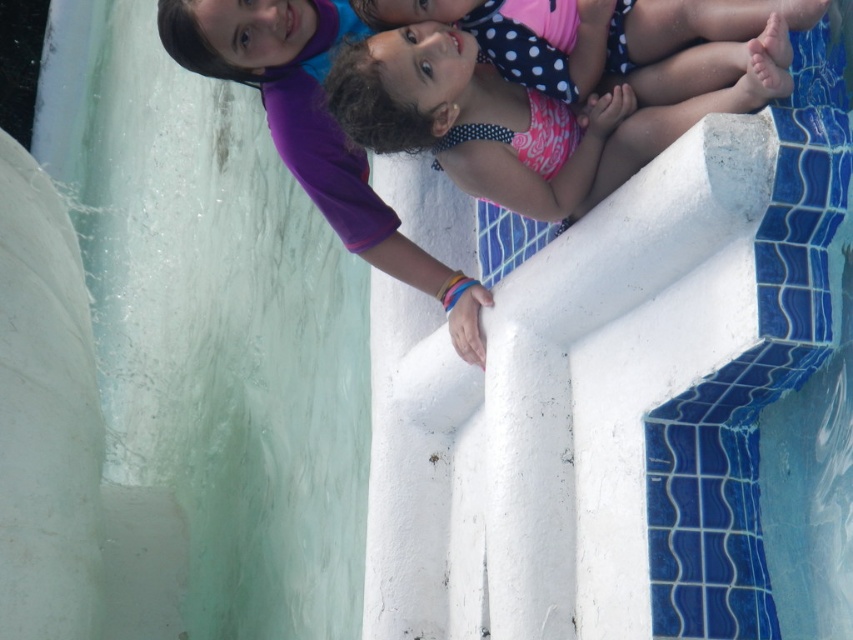
Question: Is pink polka dot swimsuit at upper center wider than pink polka dot swimsuit at center?

Choices:
 (A) yes
 (B) no

Answer: (A)

Question: Can you confirm if smooth white slide at left is positioned to the right of pink polka dot swimsuit at center?

Choices:
 (A) yes
 (B) no

Answer: (B)

Question: Which of the following is the closest to the observer?

Choices:
 (A) (477, 104)
 (B) (265, 35)
 (C) (363, 1)
 (D) (91, 636)

Answer: (A)

Question: Estimate the real-world distances between objects in this image. Which object is closer to the pink polka dot swimsuit at center?

Choices:
 (A) pink polka dot swimsuit at upper center
 (B) smooth white slide at left
 (C) purple fabric at upper center

Answer: (A)

Question: Which object appears farthest from the camera in this image?

Choices:
 (A) pink polka dot swimsuit at upper center
 (B) purple fabric at upper center
 (C) pink polka dot swimsuit at center

Answer: (B)

Question: Is pink polka dot swimsuit at upper center wider than purple fabric at upper center?

Choices:
 (A) no
 (B) yes

Answer: (B)